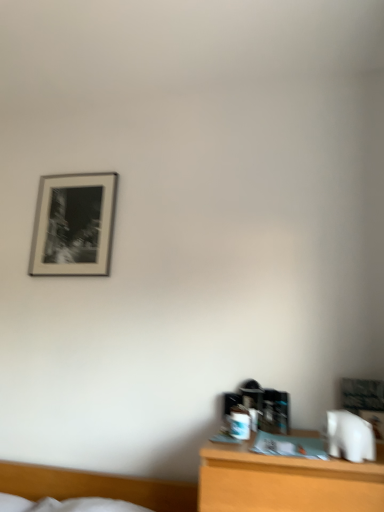
Question: From the image's perspective, is silver metallic picture frame at upper left above or below white soft bed at lower left?

Choices:
 (A) above
 (B) below

Answer: (A)

Question: Is silver metallic picture frame at upper left inside the boundaries of white soft bed at lower left, or outside?

Choices:
 (A) inside
 (B) outside

Answer: (B)

Question: From a real-world perspective, relative to white soft bed at lower left, is silver metallic picture frame at upper left vertically above or below?

Choices:
 (A) above
 (B) below

Answer: (A)

Question: From the image's perspective, is white soft bed at lower left positioned above or below silver metallic picture frame at upper left?

Choices:
 (A) below
 (B) above

Answer: (A)

Question: From a real-world perspective, is white soft bed at lower left physically located above or below silver metallic picture frame at upper left?

Choices:
 (A) above
 (B) below

Answer: (B)

Question: Is point (127, 490) closer or farther from the camera than point (87, 268)?

Choices:
 (A) farther
 (B) closer

Answer: (B)

Question: Relative to silver metallic picture frame at upper left, is white soft bed at lower left in front or behind?

Choices:
 (A) behind
 (B) front

Answer: (B)